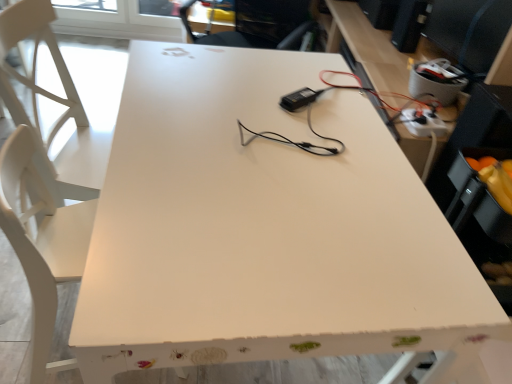
Find the location of a particular element. white plastic extension cord at upper right is located at coordinates (423, 123).

What is the approximate height of white plastic extension cord at upper right?

white plastic extension cord at upper right is 4.25 centimeters in height.

Measure the distance between white plastic extension cord at upper right and camera.

white plastic extension cord at upper right is 1.47 meters from camera.

The height and width of the screenshot is (384, 512). What do you see at coordinates (423, 123) in the screenshot?
I see `white plastic extension cord at upper right` at bounding box center [423, 123].

I want to click on white glossy computer desk at right, so click(x=373, y=49).

What do you see at coordinates (373, 49) in the screenshot? I see `white glossy computer desk at right` at bounding box center [373, 49].

What is the approximate height of white glossy computer desk at right?

white glossy computer desk at right is 3.79 feet in height.

Locate an element on the screen. This screenshot has height=384, width=512. white plastic extension cord at upper right is located at coordinates (423, 123).

Considering the positions of objects white glossy computer desk at right and white plastic extension cord at upper right in the image provided, who is more to the left, white glossy computer desk at right or white plastic extension cord at upper right?

Positioned to the left is white plastic extension cord at upper right.

Is white glossy computer desk at right behind white plastic extension cord at upper right?

That is False.

Considering the points (361, 64) and (418, 131), which point is behind, point (361, 64) or point (418, 131)?

The point (361, 64) is farther from the camera.

From the image's perspective, which one is positioned higher, white glossy computer desk at right or white plastic extension cord at upper right?

white glossy computer desk at right appears higher in the image.

From a real-world perspective, is white glossy computer desk at right located beneath white plastic extension cord at upper right?

Indeed, from a real-world perspective, white glossy computer desk at right is positioned beneath white plastic extension cord at upper right.

Can you confirm if white glossy computer desk at right is wider than white plastic extension cord at upper right?

Yes.

In the scene shown: Considering the sizes of white glossy computer desk at right and white plastic extension cord at upper right in the image, is white glossy computer desk at right taller or shorter than white plastic extension cord at upper right?

Considering their sizes, white glossy computer desk at right has more height than white plastic extension cord at upper right.

Between white glossy computer desk at right and white plastic extension cord at upper right, which one has larger size?

white glossy computer desk at right is bigger.

Is white plastic extension cord at upper right completely or partially inside white glossy computer desk at right?

Yes, white plastic extension cord at upper right is inside white glossy computer desk at right.

Are white glossy computer desk at right and white plastic extension cord at upper right beside each other?

No, white glossy computer desk at right is not next to white plastic extension cord at upper right.

Could you tell me if white glossy computer desk at right is facing white plastic extension cord at upper right?

Yes, white glossy computer desk at right faces towards white plastic extension cord at upper right.

What's the angular difference between white glossy computer desk at right and white plastic extension cord at upper right's facing directions?

The angular difference between white glossy computer desk at right and white plastic extension cord at upper right is 6.53 degrees.

Measure the distance between white glossy computer desk at right and white plastic extension cord at upper right.

white glossy computer desk at right is 48.43 centimeters away from white plastic extension cord at upper right.

I want to click on extension cord above the white glossy computer desk at right (from a real-world perspective), so click(423, 123).

Can you confirm if white plastic extension cord at upper right is positioned to the left of white glossy computer desk at right?

Indeed, white plastic extension cord at upper right is positioned on the left side of white glossy computer desk at right.

Considering the positions of objects white plastic extension cord at upper right and white glossy computer desk at right in the image provided, who is behind, white plastic extension cord at upper right or white glossy computer desk at right?

white plastic extension cord at upper right is more distant.

Is point (425, 117) in front of point (367, 45)?

Yes, it is in front of point (367, 45).

From the image's perspective, which one is positioned lower, white plastic extension cord at upper right or white glossy computer desk at right?

white plastic extension cord at upper right is shown below in the image.

From a real-world perspective, is white plastic extension cord at upper right physically located above or below white glossy computer desk at right?

white plastic extension cord at upper right is above white glossy computer desk at right.

Considering the relative sizes of white plastic extension cord at upper right and white glossy computer desk at right in the image provided, is white plastic extension cord at upper right wider than white glossy computer desk at right?

In fact, white plastic extension cord at upper right might be narrower than white glossy computer desk at right.

In terms of height, does white plastic extension cord at upper right look taller or shorter compared to white glossy computer desk at right?

white plastic extension cord at upper right is shorter than white glossy computer desk at right.

Does white plastic extension cord at upper right have a larger size compared to white glossy computer desk at right?

Actually, white plastic extension cord at upper right might be smaller than white glossy computer desk at right.

Is white plastic extension cord at upper right outside of white glossy computer desk at right?

That's incorrect, white plastic extension cord at upper right is not completely outside white glossy computer desk at right.

In the scene shown: Are white plastic extension cord at upper right and white glossy computer desk at right far apart?

Actually, white plastic extension cord at upper right and white glossy computer desk at right are a little close together.

Is white plastic extension cord at upper right facing away from white glossy computer desk at right?

Yes, white plastic extension cord at upper right's orientation is away from white glossy computer desk at right.

The height and width of the screenshot is (384, 512). I want to click on extension cord that is above the white glossy computer desk at right (from a real-world perspective), so click(423, 123).

Where is `extension cord that appears below the white glossy computer desk at right (from the image's perspective)`? Image resolution: width=512 pixels, height=384 pixels. extension cord that appears below the white glossy computer desk at right (from the image's perspective) is located at coordinates (423, 123).

This screenshot has width=512, height=384. What are the coordinates of `extension cord that is above the white glossy computer desk at right (from a real-world perspective)` in the screenshot? It's located at (423, 123).